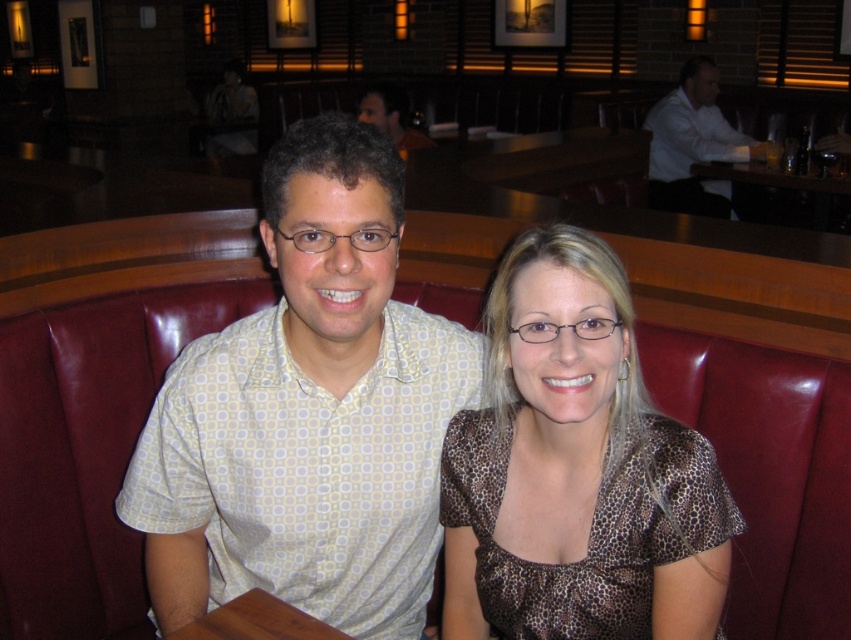
You are a photographer taking a picture of two people in a restaurant. You notice the brown leopard print blouse at center and the white shirt at upper right. Which clothing item is positioned lower in the image?

The brown leopard print blouse at center is positioned lower than the white shirt at upper right.

You are standing in the restaurant and want to take a photo of the point at coordinates (538, 305). The camera you are using has a minimum focus distance of 35 inches. Will the camera be able to focus on the point?

The point at coordinates (538, 305) is 36.14 inches from the camera, which is beyond the minimum focus distance of 35 inches. Therefore, the camera should be able to focus on the point.